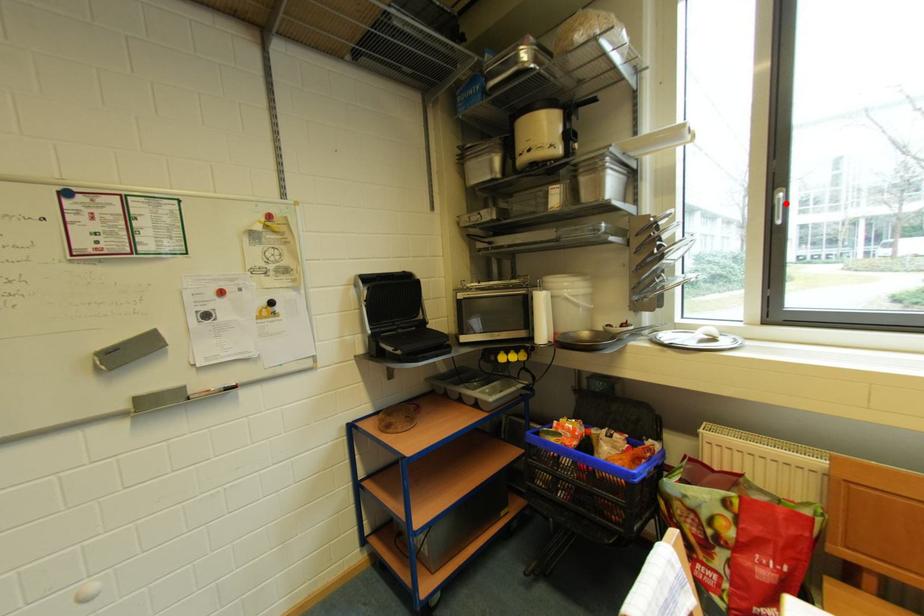
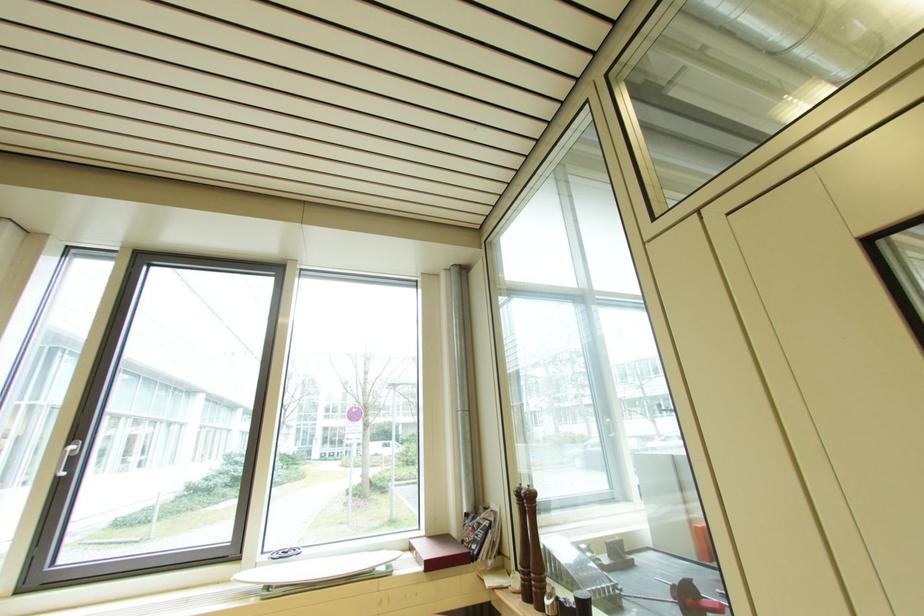
Question: I am providing you with two images of the same scene from different viewpoints. Given a red point in image1, look at the same physical point in image2. Is it:

Choices:
 (A) Closer to the viewpoint
 (B) Farther from the viewpoint

Answer: (A)